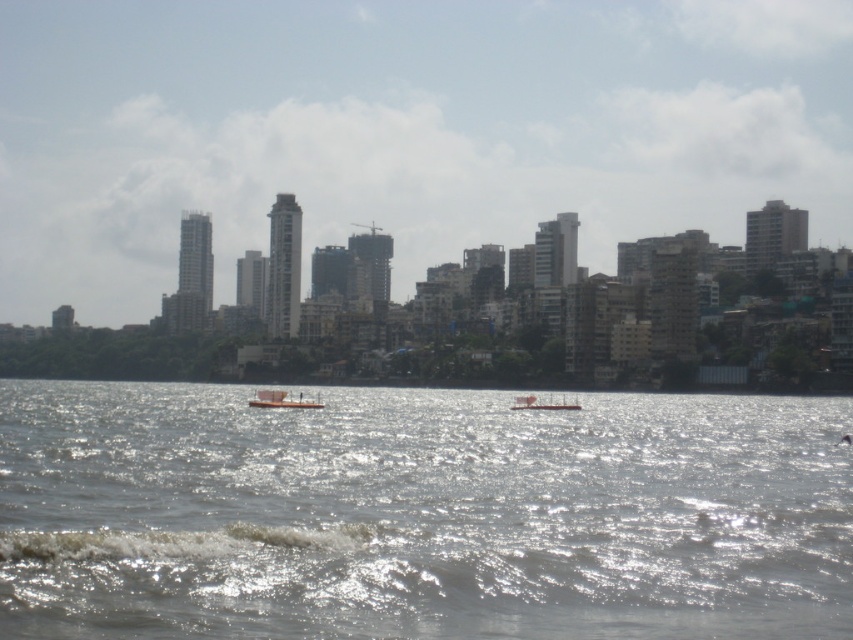
Question: Does shiny silver water at center come in front of orange matte boat at center?

Choices:
 (A) yes
 (B) no

Answer: (A)

Question: Which of the following is the farthest from the observer?

Choices:
 (A) white plastic boat at center
 (B) orange matte boat at center
 (C) shiny silver water at center

Answer: (A)

Question: Does shiny silver water at center have a lesser width compared to orange matte boat at center?

Choices:
 (A) no
 (B) yes

Answer: (A)

Question: Among these objects, which one is farthest from the camera?

Choices:
 (A) white plastic boat at center
 (B) shiny silver water at center
 (C) orange matte boat at center

Answer: (A)

Question: In this image, where is shiny silver water at center located relative to orange matte boat at center?

Choices:
 (A) right
 (B) left

Answer: (A)

Question: Estimate the real-world distances between objects in this image. Which object is farther from the shiny silver water at center?

Choices:
 (A) orange matte boat at center
 (B) white plastic boat at center

Answer: (B)